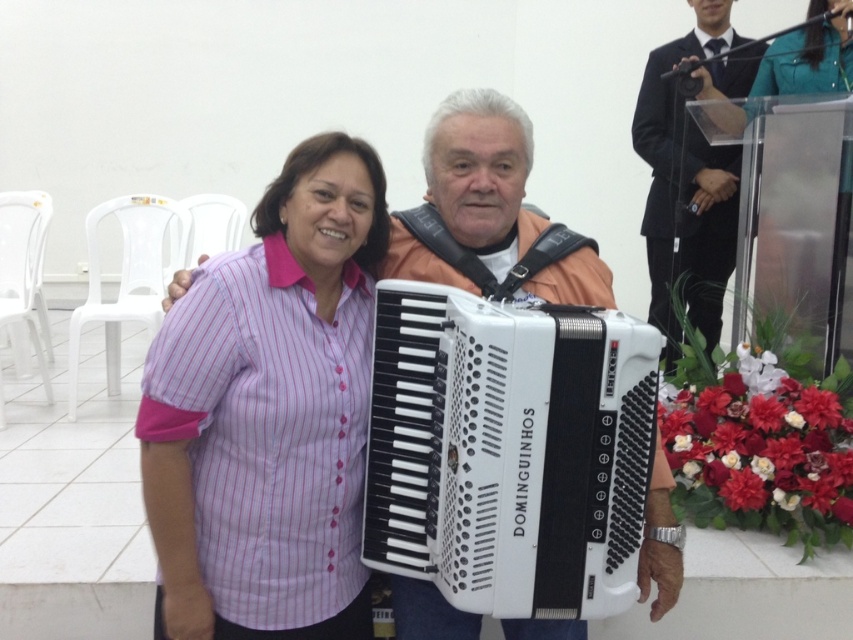
Is point (233, 312) positioned behind point (682, 161)?

No, (233, 312) is closer to viewer.

Who is positioned more to the right, pink striped shirt at center or black suit at upper right?

black suit at upper right

Does point (363, 364) come in front of point (712, 336)?

Yes, point (363, 364) is in front of point (712, 336).

Identify the location of pink striped shirt at center. (270, 413).

Identify the location of pink striped shirt at center. 270,413.

Does point (276, 428) come farther from viewer compared to point (722, 125)?

No, it is in front of (722, 125).

Locate an element on the screen. pink striped shirt at center is located at coordinates (270, 413).

Is point (698, 138) positioned in front of point (813, 29)?

No, it is behind (813, 29).

Is point (648, 109) behind point (833, 56)?

Yes.

Image resolution: width=853 pixels, height=640 pixels. Find the location of `black suit at upper right`. black suit at upper right is located at coordinates (686, 186).